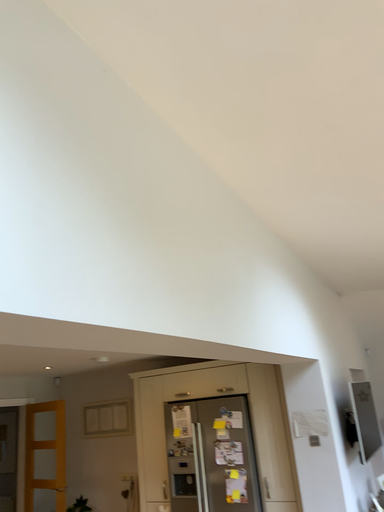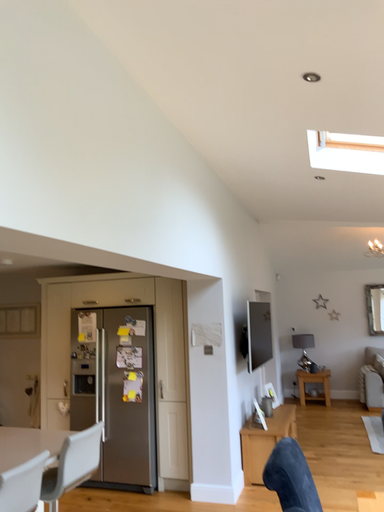
Question: How did the camera likely rotate when shooting the video?

Choices:
 (A) rotated upward
 (B) rotated downward

Answer: (B)